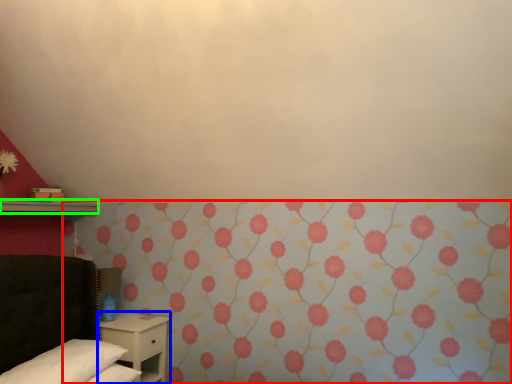
Question: Which is farther away from curtain (highlighted by a red box)? nightstand (highlighted by a blue box) or shelf (highlighted by a green box)?

Choices:
 (A) nightstand
 (B) shelf

Answer: (B)